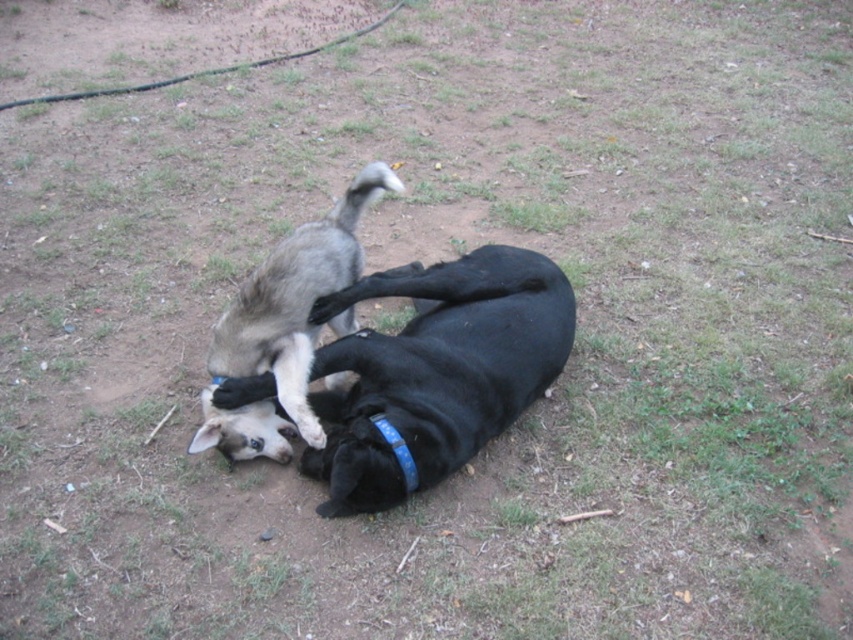
Which is behind, point (370, 182) or point (380, 413)?

The point (370, 182) is more distant.

Can you confirm if gray fur puppy at center is bigger than blue plastic neckband at center?

Yes.

You are a GUI agent. You are given a task and a screenshot of the screen. Output one action in this format:
    pyautogui.click(x=<x>, y=<y>)
    Task: Click on the gray fur puppy at center
    
    Given the screenshot: What is the action you would take?
    pyautogui.click(x=283, y=326)

Identify the location of gray fur puppy at center. [x=283, y=326].

Does black matte dog at center have a smaller size compared to blue plastic neckband at center?

Actually, black matte dog at center might be larger than blue plastic neckband at center.

Between black matte dog at center and blue plastic neckband at center, which one has more height?

With more height is black matte dog at center.

This screenshot has height=640, width=853. I want to click on black matte dog at center, so pos(438,371).

Which of these two, black matte dog at center or gray fur puppy at center, stands taller?

With more height is gray fur puppy at center.

This screenshot has height=640, width=853. I want to click on black matte dog at center, so click(438, 371).

Image resolution: width=853 pixels, height=640 pixels. Find the location of `black matte dog at center`. black matte dog at center is located at coordinates (x=438, y=371).